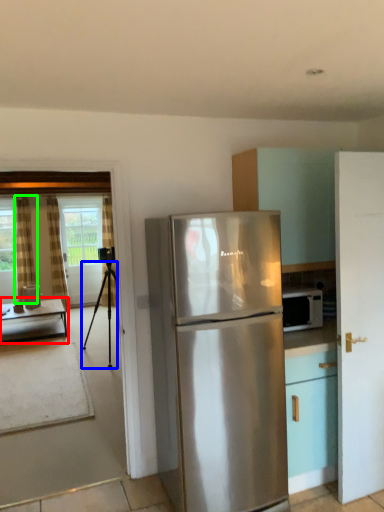
Question: Based on their relative distances, which object is farther from table (highlighted by a red box)? Choose from tripod (highlighted by a blue box) and curtain (highlighted by a green box).

Choices:
 (A) tripod
 (B) curtain

Answer: (A)